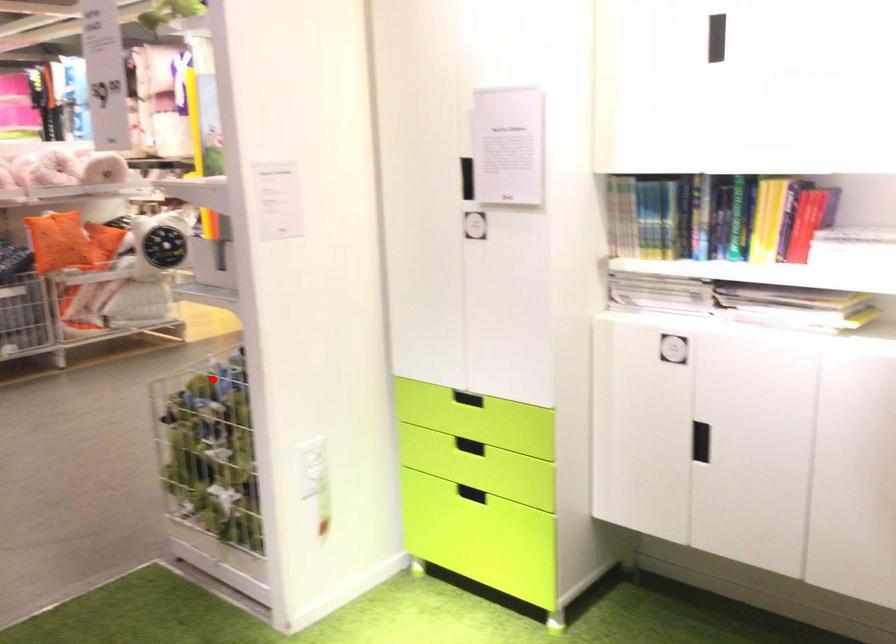
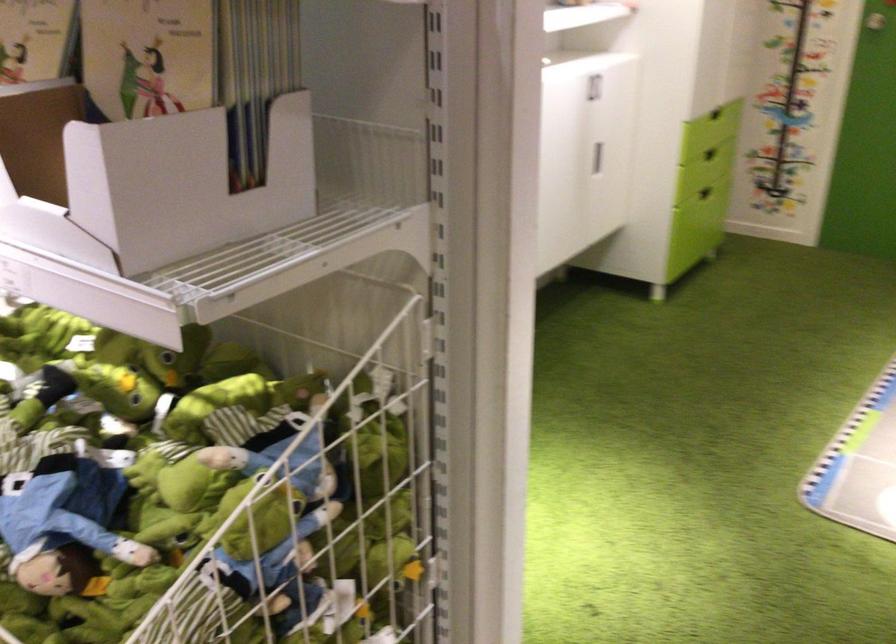
The point at the highlighted location is marked in the first image. Where is the corresponding point in the second image?

(254, 516)